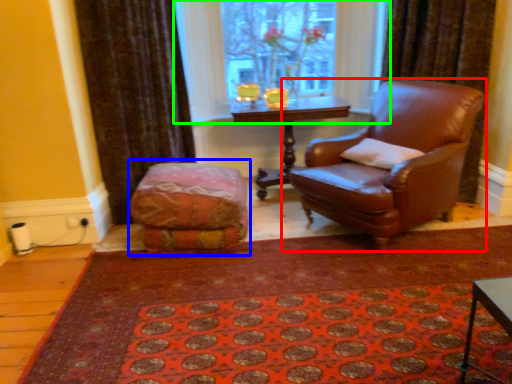
Question: Which object is the closest to the chair (highlighted by a red box)? Choose among these: bean bag chair (highlighted by a blue box) or window (highlighted by a green box).

Choices:
 (A) bean bag chair
 (B) window

Answer: (A)